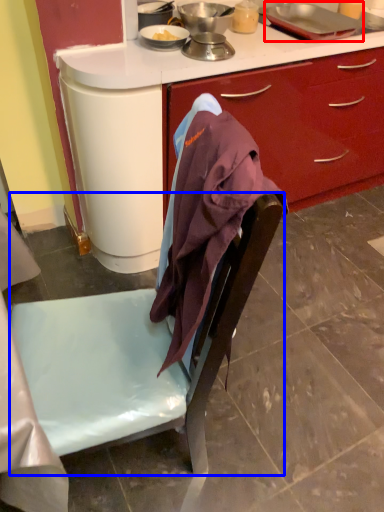
Question: Which point is closer to the camera, kitchen appliance (highlighted by a red box) or chair (highlighted by a blue box)?

Choices:
 (A) kitchen appliance
 (B) chair

Answer: (B)